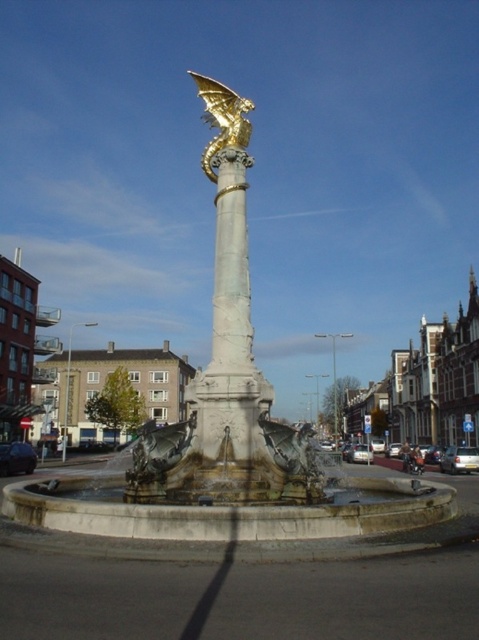
Question: Considering the real-world distances, which object is farthest from the white marble column at center?

Choices:
 (A) gold metallic dragon at upper center
 (B) bronze fountain at center

Answer: (A)

Question: Can you confirm if bronze fountain at center is positioned to the left of gold metallic dragon at upper center?

Choices:
 (A) yes
 (B) no

Answer: (B)

Question: Is white marble column at center below gold metallic dragon at upper center?

Choices:
 (A) no
 (B) yes

Answer: (B)

Question: Based on their relative distances, which object is nearer to the bronze fountain at center?

Choices:
 (A) white marble column at center
 (B) gold metallic dragon at upper center

Answer: (A)

Question: Considering the relative positions of bronze fountain at center and gold metallic dragon at upper center in the image provided, where is bronze fountain at center located with respect to gold metallic dragon at upper center?

Choices:
 (A) below
 (B) above

Answer: (A)

Question: Among these points, which one is nearest to the camera?

Choices:
 (A) pos(148,468)
 (B) pos(231,269)

Answer: (A)